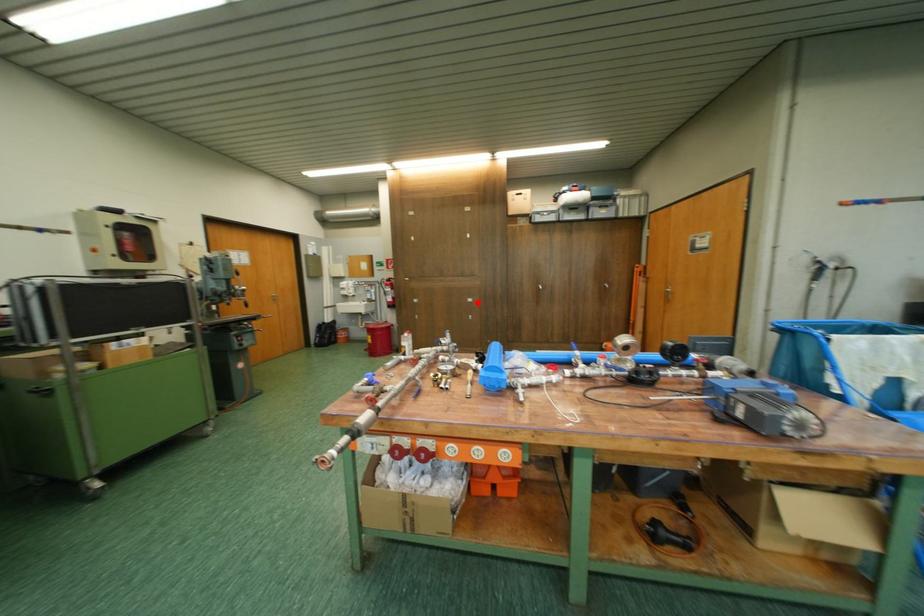
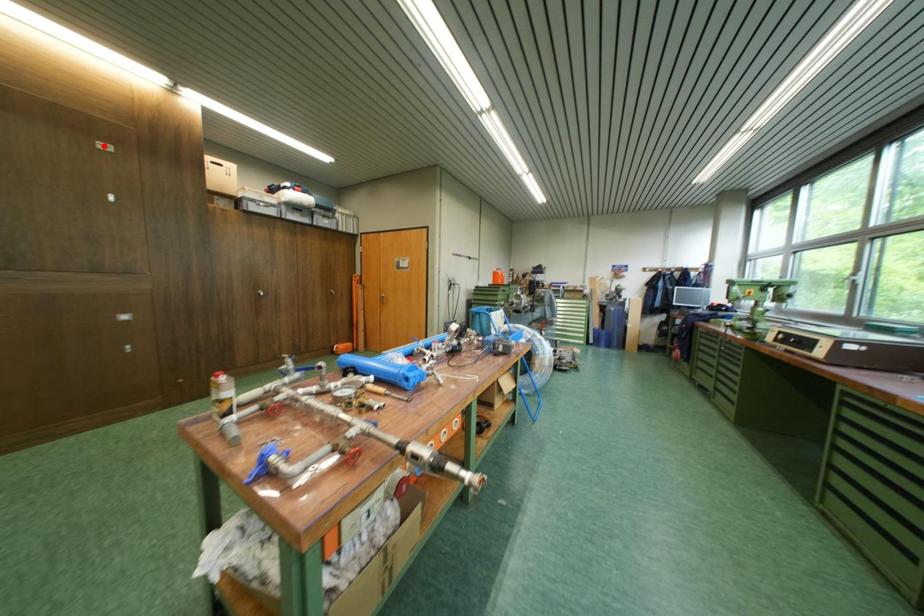
I am providing you with two images of the same scene from different viewpoints. A red point is marked on the first image and another point is marked on the second image. Do the highlighted points in image1 and image2 indicate the same real-world spot?

No